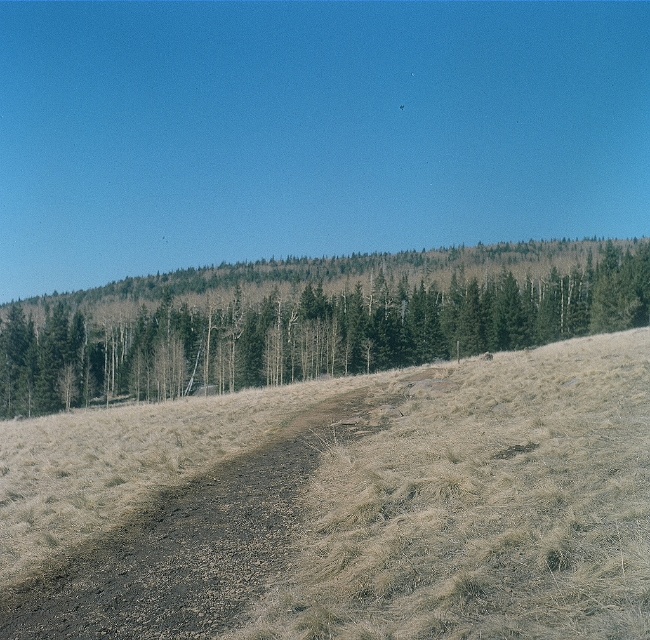
You are planning to take a photo of the green matte trees at upper center and the brown dirt track at center. Which object should you focus on first if you want to capture both in a single frame without moving the camera?

You should focus on the green matte trees at upper center first because it is larger than the brown dirt track at center, allowing you to adjust the framing to include both objects more easily.

You are standing at the starting point of the dirt path in the image. Looking towards the green matte trees at upper center, what direction should you walk to reach them?

Since the green matte trees at upper center are located at point [306,323] in the image, you should walk forward along the dirt path to reach them as they are positioned in the central upper area of the scene.